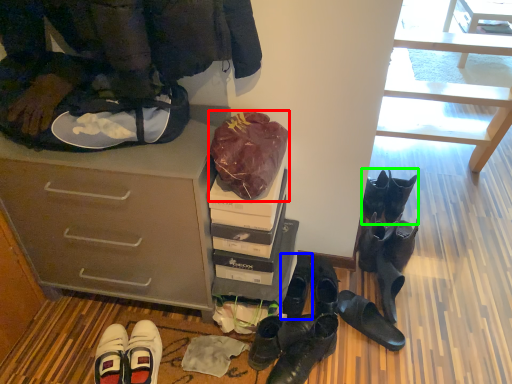
Question: Considering the real-world distances, which object is farthest from bag (highlighted by a red box)? footwear (highlighted by a blue box) or footwear (highlighted by a green box)?

Choices:
 (A) footwear
 (B) footwear

Answer: (B)